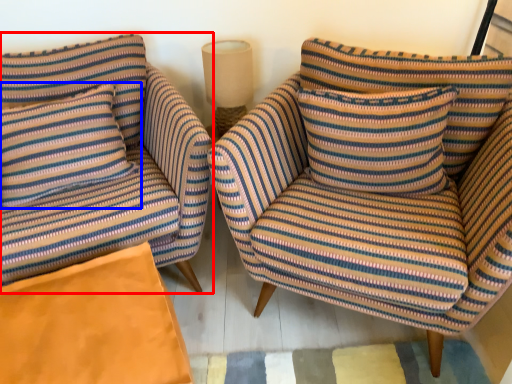
Question: Which point is closer to the camera, chair (highlighted by a red box) or pillow (highlighted by a blue box)?

Choices:
 (A) chair
 (B) pillow

Answer: (A)